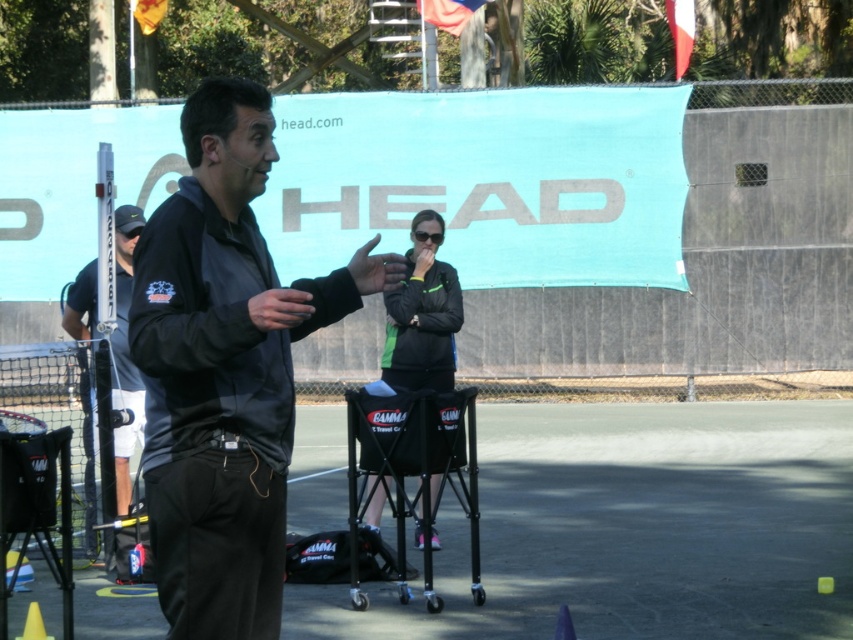
You are a photographer setting up a tripod in the tennis court scene. You need to place your tripod so that it doesn not block the view of the black matte jacket at center and the black matte pole at left. Where should you position the tripod relative to these objects?

The black matte jacket at center is positioned over the black matte pole at left. To avoid blocking the view of both objects, place the tripod behind the black matte jacket at center so it remains visible while not obstructing the pole underneath.

You are a photographer setting up equipment on the tennis court. You have a camera that can only focus on objects wider than 1 meter. You see the black matte jacket at center and the yellow matte cone at lower left. Can the camera focus on both objects?

The black matte jacket at center might be wider than yellow matte cone at lower left, so the camera can focus on the black matte jacket at center if it is wider than 1 meter. However, it is uncertain if the yellow matte cone at lower left meets the width requirement since its width is not specified.